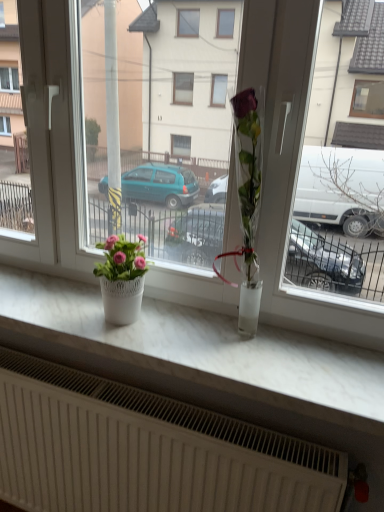
Locate an element on the screen. The image size is (384, 512). blank space above white marble counter top at center (from a real-world perspective) is located at coordinates (155, 326).